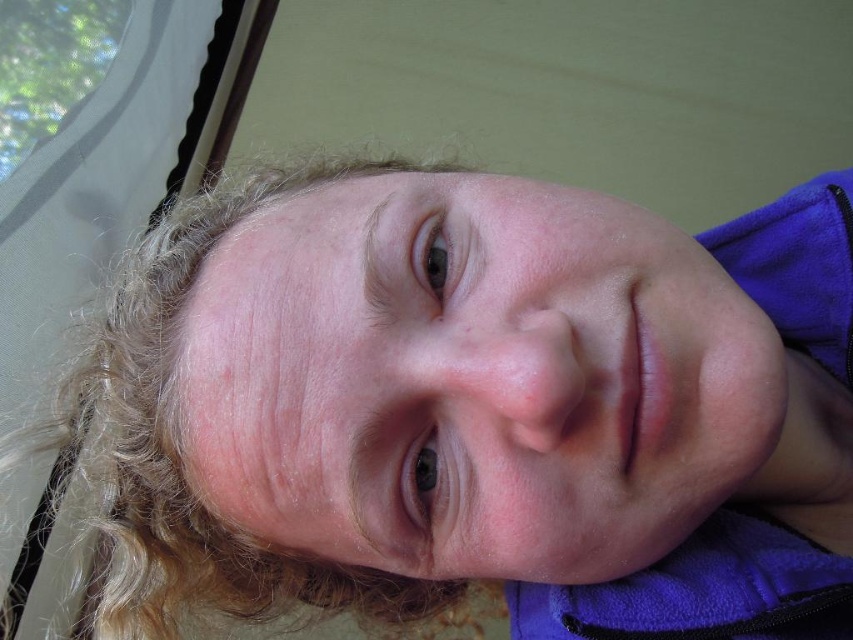
Question: Does smooth skin face at center appear over blonde curly hair at upper left?

Choices:
 (A) no
 (B) yes

Answer: (B)

Question: Does smooth skin face at center have a greater width compared to blonde curly hair at upper left?

Choices:
 (A) yes
 (B) no

Answer: (B)

Question: Which point is farther to the camera?

Choices:
 (A) smooth skin face at center
 (B) blonde curly hair at upper left

Answer: (B)

Question: Does smooth skin face at center have a lesser width compared to blonde curly hair at upper left?

Choices:
 (A) no
 (B) yes

Answer: (B)

Question: Which of the following is the closest to the observer?

Choices:
 (A) smooth skin face at center
 (B) blonde curly hair at upper left

Answer: (A)

Question: Among these objects, which one is nearest to the camera?

Choices:
 (A) smooth skin face at center
 (B) blonde curly hair at upper left

Answer: (A)